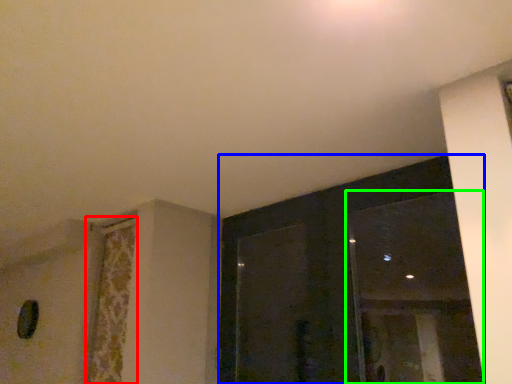
Question: Which object is the farthest from curtain (highlighted by a red box)? Choose among these: window (highlighted by a blue box) or window (highlighted by a green box).

Choices:
 (A) window
 (B) window

Answer: (B)